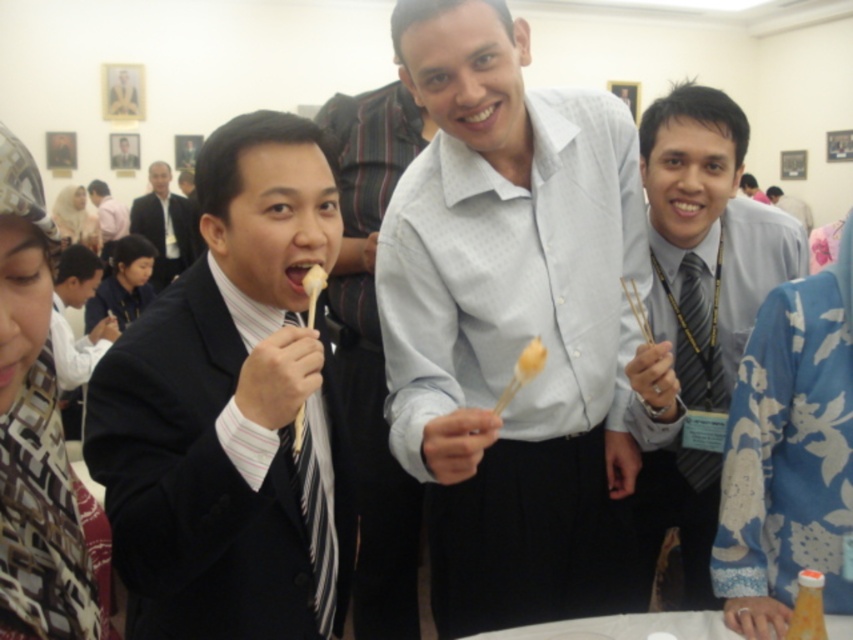
Question: Which of the following is the farthest from the observer?

Choices:
 (A) white matte toothpick at center
 (B) white glossy table at lower center
 (C) yellow matte food at mouth

Answer: (B)

Question: Is the position of black striped tie at center more distant than that of white matte toothpick at center?

Choices:
 (A) no
 (B) yes

Answer: (B)

Question: Is light blue shirt at center wider than white matte toothpick at center?

Choices:
 (A) yes
 (B) no

Answer: (A)

Question: Can you confirm if light blue shirt at center is thinner than white matte toothpick at center?

Choices:
 (A) no
 (B) yes

Answer: (A)

Question: Which is farther from the black satin suit at left?

Choices:
 (A) white matte toothpick at center
 (B) black striped tie at center
 (C) yellow matte skewer at center

Answer: (B)

Question: Estimate the real-world distances between objects in this image. Which object is closer to the gray striped tie at right?

Choices:
 (A) pink matte lips at center
 (B) light blue shirt at center
 (C) white glossy table at lower center

Answer: (B)